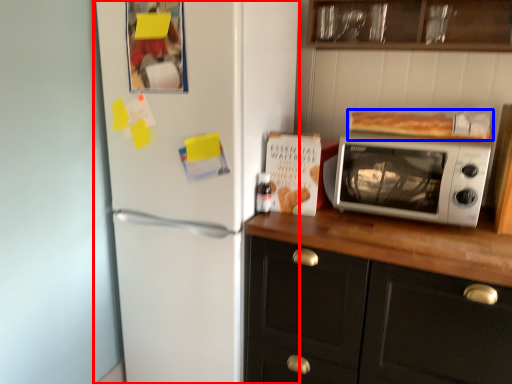
Question: Among these objects, which one is nearest to the camera, refrigerator (highlighted by a red box) or food (highlighted by a blue box)?

Choices:
 (A) refrigerator
 (B) food

Answer: (A)